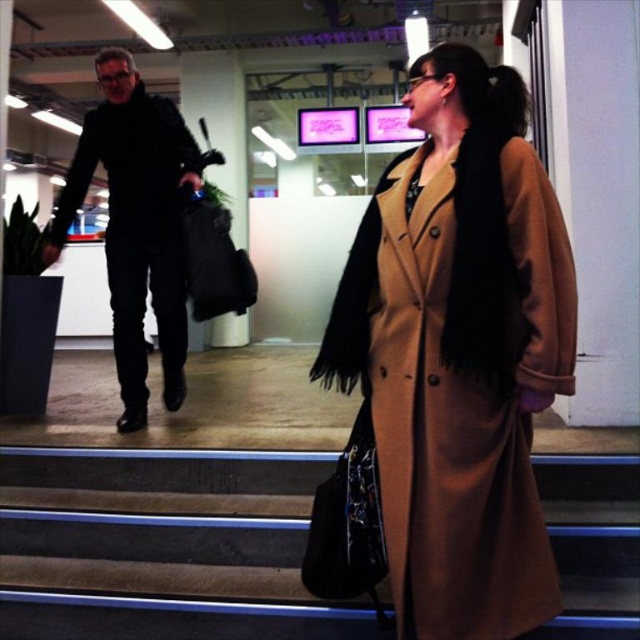
Who is taller, brown wooden stairs at center or black matte jacket at left?

Standing taller between the two is black matte jacket at left.

Does brown wooden stairs at center have a greater width compared to black matte jacket at left?

Yes, brown wooden stairs at center is wider than black matte jacket at left.

Is point (12, 616) closer to viewer compared to point (83, 129)?

Yes, point (12, 616) is in front of point (83, 129).

What are the coordinates of `brown wooden stairs at center` in the screenshot? It's located at (163, 548).

Where is `tan wool coat at center`? The height and width of the screenshot is (640, 640). tan wool coat at center is located at coordinates (460, 352).

Does tan wool coat at center have a greater height compared to black matte jacket at left?

No, tan wool coat at center is not taller than black matte jacket at left.

You are a GUI agent. You are given a task and a screenshot of the screen. Output one action in this format:
    pyautogui.click(x=<x>, y=<y>)
    Task: Click on the tan wool coat at center
    The image size is (640, 640).
    Given the screenshot: What is the action you would take?
    pyautogui.click(x=460, y=352)

How far apart are tan wool coat at center and brown wooden stairs at center?

tan wool coat at center and brown wooden stairs at center are 33.93 inches apart from each other.

Is tan wool coat at center wider than brown wooden stairs at center?

In fact, tan wool coat at center might be narrower than brown wooden stairs at center.

Between point (412, 301) and point (205, 528), which one is positioned in front?

Positioned in front is point (412, 301).

This screenshot has width=640, height=640. Identify the location of tan wool coat at center. (460, 352).